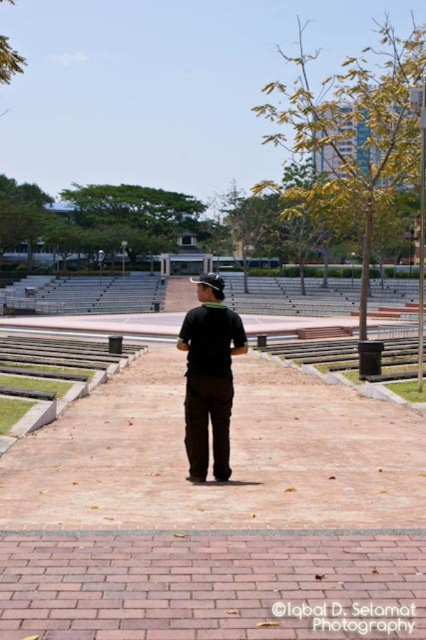
You are standing at the point labeled as point (230, 456) in the image. Based on the scene description, what type of surface are you currently standing on?

The point (230, 456) indicates brown brick path at center, so you are standing on a brown brick path.

You are standing at the edge of the brown brick path at center and want to place the black matte shirt at center on the path without it being stepped on. Given the size difference between them, is this possible?

The brown brick path at center has a larger size compared to black matte shirt at center, so placing the black matte shirt at center on the path would leave enough space around it to avoid being stepped on.

You are a park visitor carrying a 1.2 meter wide picnic blanket. You want to lay it on the brown brick path at center or the black matte shirt at center. Which location has enough space to accommodate the blanket without overlapping?

The brown brick path at center has a larger width than the black matte shirt at center, so the picnic blanket can be placed on the brown brick path at center since it provides sufficient space.